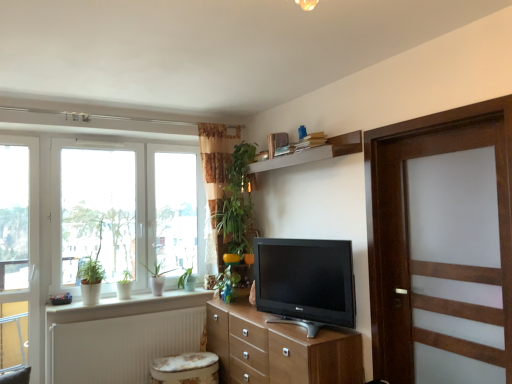
Question: Is wooden door at right to the left of white ceramic pots at lower left from the viewer's perspective?

Choices:
 (A) yes
 (B) no

Answer: (B)

Question: Is wooden door at right positioned in front of white ceramic pots at lower left?

Choices:
 (A) no
 (B) yes

Answer: (B)

Question: Considering the relative sizes of wooden door at right and white ceramic pots at lower left in the image provided, is wooden door at right bigger than white ceramic pots at lower left?

Choices:
 (A) yes
 (B) no

Answer: (A)

Question: Is wooden door at right not near white ceramic pots at lower left?

Choices:
 (A) no
 (B) yes

Answer: (B)

Question: From a real-world perspective, is wooden door at right positioned over white ceramic pots at lower left based on gravity?

Choices:
 (A) no
 (B) yes

Answer: (B)

Question: In terms of height, does wooden shelf at upper center look taller or shorter compared to wooden door at right?

Choices:
 (A) tall
 (B) short

Answer: (B)

Question: In terms of width, does wooden shelf at upper center look wider or thinner when compared to wooden door at right?

Choices:
 (A) thin
 (B) wide

Answer: (A)

Question: In the image, is wooden shelf at upper center on the left side or the right side of wooden door at right?

Choices:
 (A) left
 (B) right

Answer: (A)

Question: Is wooden shelf at upper center in front of or behind wooden door at right in the image?

Choices:
 (A) front
 (B) behind

Answer: (B)

Question: Considering the positions of green glossy plant at center, the first plant positioned from the right, and matte black tv at center in the image, is green glossy plant at center, the first plant positioned from the right, wider or thinner than matte black tv at center?

Choices:
 (A) thin
 (B) wide

Answer: (A)

Question: Do you think green glossy plant at center, which is the 2th plant in left-to-right order, is within matte black tv at center, or outside of it?

Choices:
 (A) outside
 (B) inside

Answer: (A)

Question: Is green glossy plant at center, which is the 2th plant in left-to-right order, to the left or to the right of matte black tv at center in the image?

Choices:
 (A) right
 (B) left

Answer: (B)

Question: From a real-world perspective, relative to matte black tv at center, is green glossy plant at center, which is the 2th plant in left-to-right order, vertically above or below?

Choices:
 (A) below
 (B) above

Answer: (A)

Question: Considering their positions, is green glossy plant at left, arranged as the first plant when viewed from the left, located in front of or behind transparent glass door at left?

Choices:
 (A) behind
 (B) front

Answer: (A)

Question: Based on their sizes in the image, would you say green glossy plant at left, which ranks as the 2th plant in right-to-left order, is bigger or smaller than transparent glass door at left?

Choices:
 (A) big
 (B) small

Answer: (A)